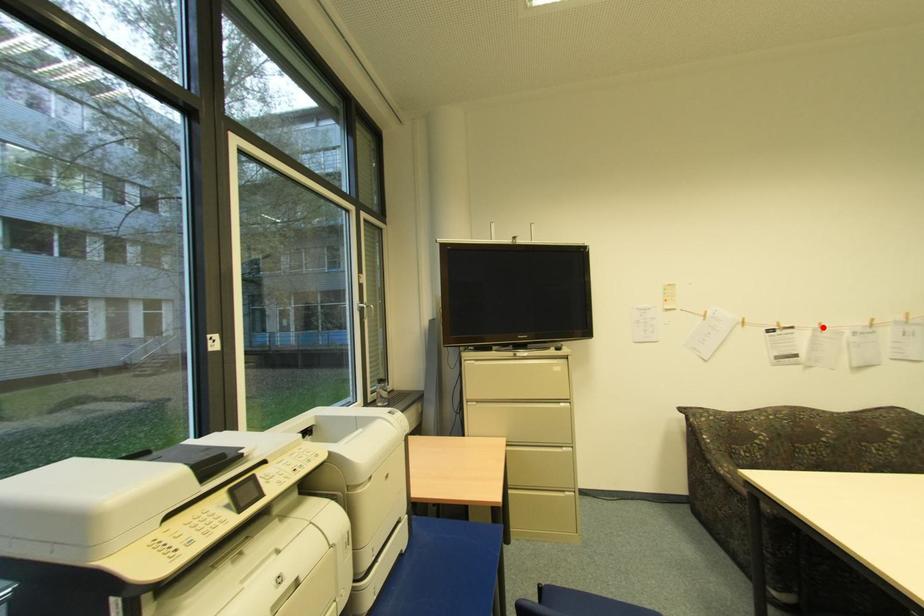
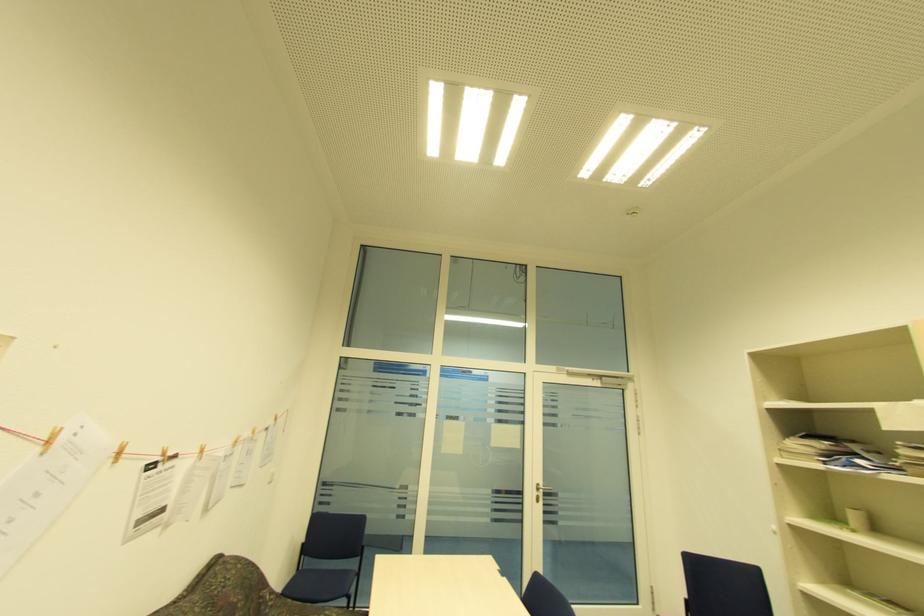
The point at the highlighted location is marked in the first image. Where is the corresponding point in the second image?

(203, 453)